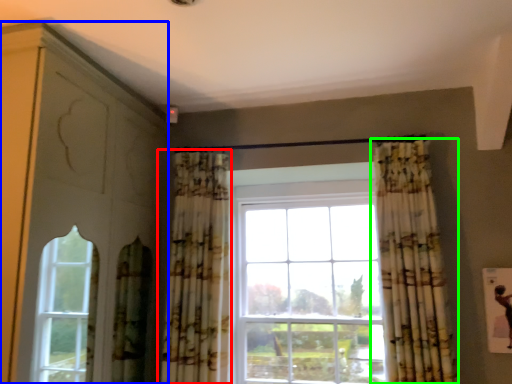
Question: Considering the real-world distances, which object is closest to curtain (highlighted by a red box)? dresser (highlighted by a blue box) or curtain (highlighted by a green box).

Choices:
 (A) dresser
 (B) curtain

Answer: (A)